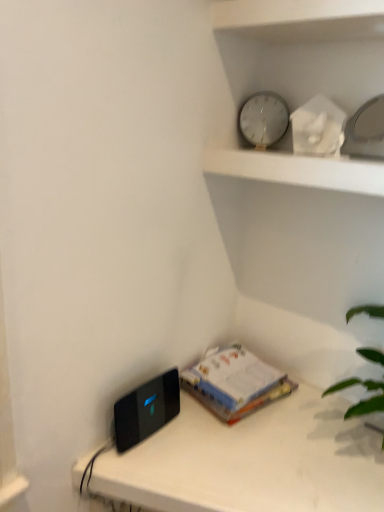
Question: Is the depth of black glossy ipod at lower left greater than that of white paper at center?

Choices:
 (A) yes
 (B) no

Answer: (B)

Question: Does black glossy ipod at lower left appear on the left side of white paper at center?

Choices:
 (A) yes
 (B) no

Answer: (A)

Question: Is black glossy ipod at lower left outside of white paper at center?

Choices:
 (A) no
 (B) yes

Answer: (B)

Question: From a real-world perspective, is black glossy ipod at lower left on white paper at center?

Choices:
 (A) yes
 (B) no

Answer: (A)

Question: Is black glossy ipod at lower left surrounding white paper at center?

Choices:
 (A) no
 (B) yes

Answer: (A)

Question: Is metallic clock at upper center in front of or behind white paper at center in the image?

Choices:
 (A) front
 (B) behind

Answer: (A)

Question: From the image's perspective, is metallic clock at upper center located above or below white paper at center?

Choices:
 (A) above
 (B) below

Answer: (A)

Question: Considering the positions of metallic clock at upper center and white paper at center in the image, is metallic clock at upper center taller or shorter than white paper at center?

Choices:
 (A) tall
 (B) short

Answer: (A)

Question: Do you think metallic clock at upper center is within white paper at center, or outside of it?

Choices:
 (A) inside
 (B) outside

Answer: (B)

Question: Do you think metallic clock at upper center is within black plastic device at lower left, or outside of it?

Choices:
 (A) outside
 (B) inside

Answer: (A)

Question: Is metallic clock at upper center wider or thinner than black plastic device at lower left?

Choices:
 (A) wide
 (B) thin

Answer: (B)

Question: Considering the positions of metallic clock at upper center and black plastic device at lower left in the image, is metallic clock at upper center bigger or smaller than black plastic device at lower left?

Choices:
 (A) big
 (B) small

Answer: (B)

Question: In the image, is metallic clock at upper center positioned in front of or behind black plastic device at lower left?

Choices:
 (A) behind
 (B) front

Answer: (A)

Question: From a real-world perspective, is black glossy ipod at lower left physically located above or below white glass clock at upper center?

Choices:
 (A) below
 (B) above

Answer: (A)

Question: Is black glossy ipod at lower left spatially inside white glass clock at upper center, or outside of it?

Choices:
 (A) outside
 (B) inside

Answer: (A)